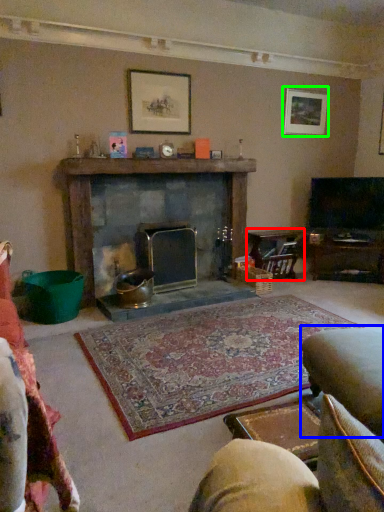
Question: Considering the real-world distances, which object is farthest from table (highlighted by a red box)? swivel chair (highlighted by a blue box) or picture frame (highlighted by a green box)?

Choices:
 (A) swivel chair
 (B) picture frame

Answer: (A)